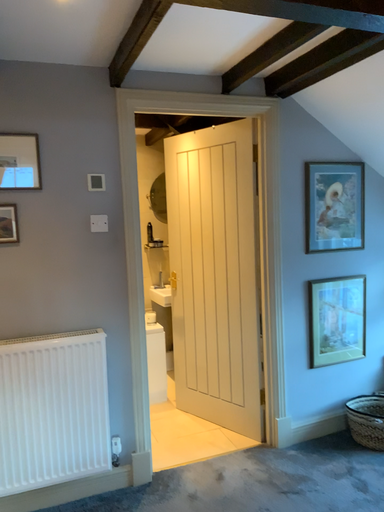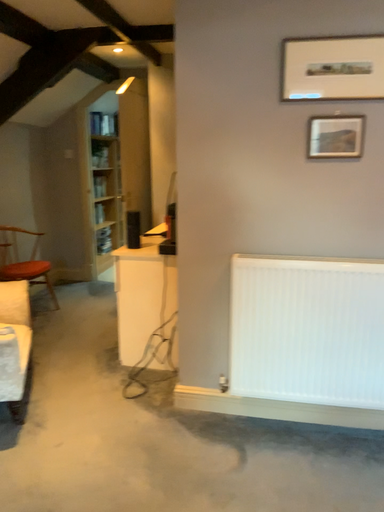
Question: How did the camera likely rotate when shooting the video?

Choices:
 (A) rotated upward
 (B) rotated downward

Answer: (B)